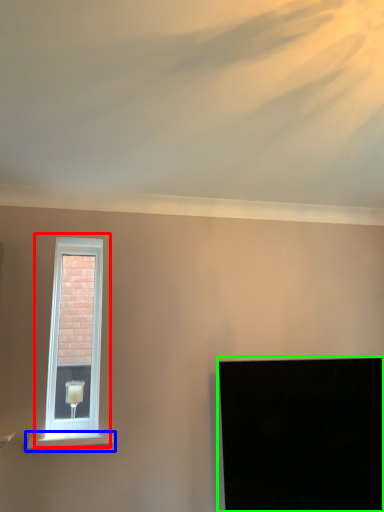
Question: Which object is positioned farthest from window (highlighted by a red box)? Select from window sill (highlighted by a blue box) and computer screen (highlighted by a green box).

Choices:
 (A) window sill
 (B) computer screen

Answer: (B)